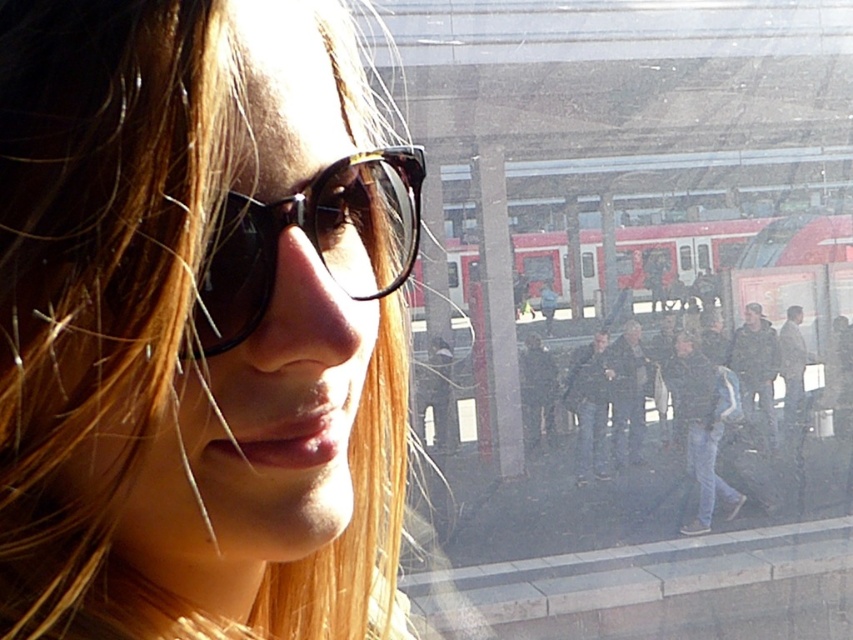
You are a fashion designer analyzing the image. You need to determine the spatial relationship between the black plastic sunglasses at center and the dark gray fabric jacket at center. Which object is positioned higher in the image?

The black plastic sunglasses at center is above dark gray fabric jacket at center, so the sunglasses are positioned higher in the image.

You are a fashion blogger analyzing the image of a person at a train station. You notice the matte black sunglasses at center and the blue jeans at center. Which item is positioned higher on the person?

The matte black sunglasses at center is positioned higher on the person than the blue jeans at center because it is shorter than the blue jeans at center, indicating it is located above.

You are a tailor who needs to measure the distance between the blue jeans at center and the dark gray fabric jacket at center. Can you fit a 2.5 meter long measuring tape between them?

The blue jeans at center and dark gray fabric jacket at center are 2.77 meters apart, so yes, the 2.5 meter long measuring tape can fit between them since the distance is longer than the tape.